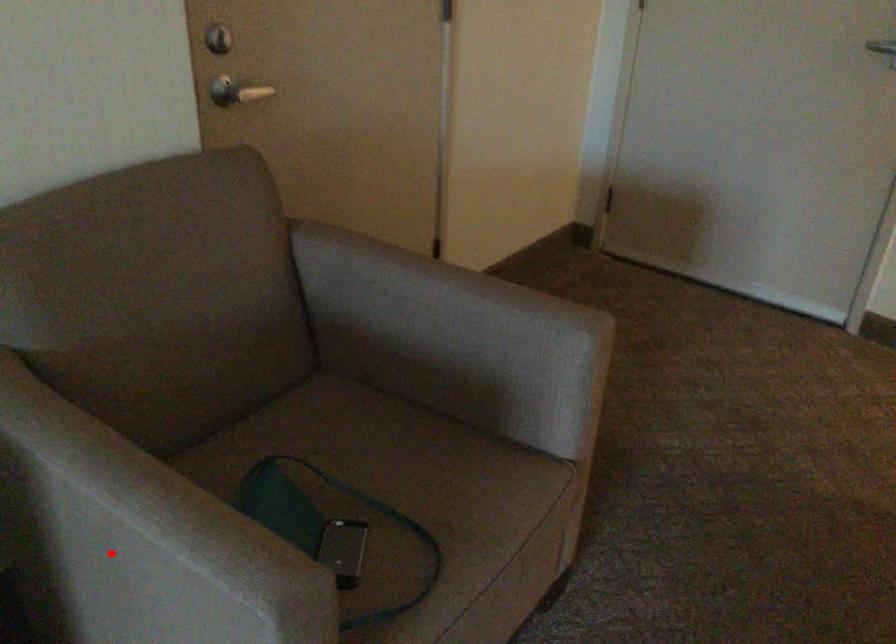
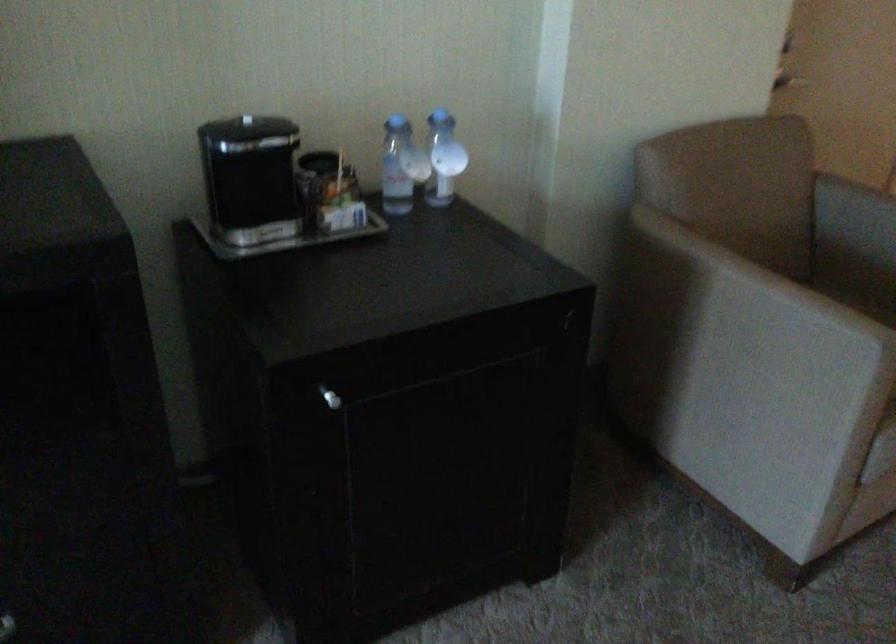
Question: I am providing you with two images of the same scene from different viewpoints. Image1 has a red point marked. In image2, the corresponding 3D location appears at what relative position? Reply with the corresponding letter.

Choices:
 (A) Closer
 (B) Farther

Answer: (B)